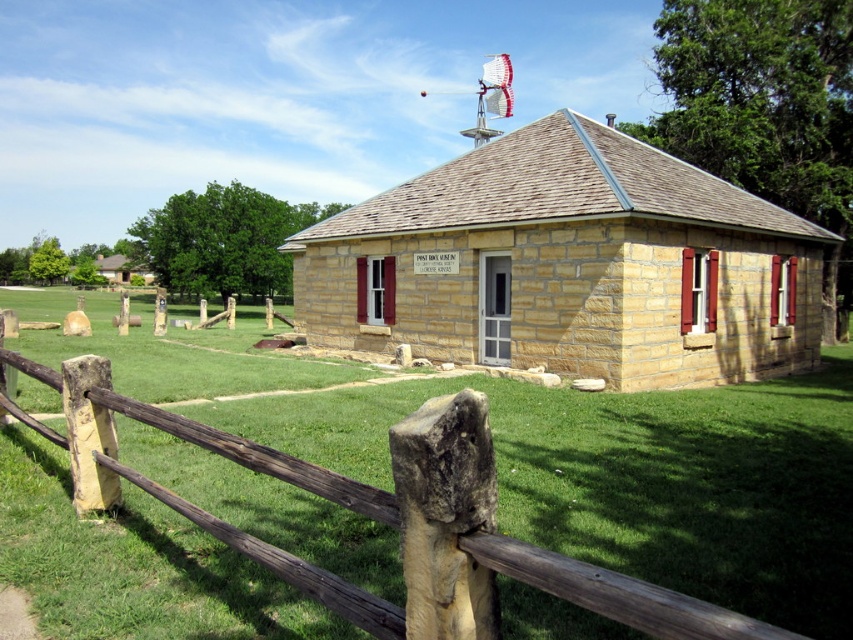
Can you confirm if brown stone building at center is positioned below brown wooden fence at lower left?

Incorrect, brown stone building at center is not positioned below brown wooden fence at lower left.

Can you confirm if brown stone building at center is positioned above brown wooden fence at lower left?

Indeed, brown stone building at center is positioned over brown wooden fence at lower left.

Measure the distance between point (445, 282) and camera.

Point (445, 282) is 49.03 feet away from camera.

I want to click on brown stone building at center, so click(569, 264).